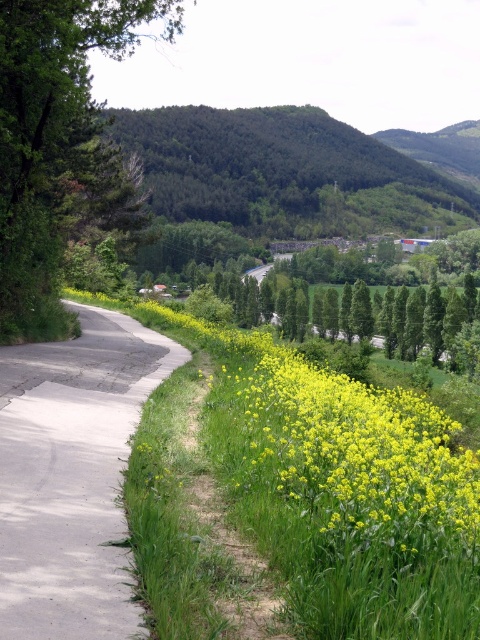
How distant is gray concrete road at center from yellow-green leafy plant at lower center?

gray concrete road at center and yellow-green leafy plant at lower center are 2.49 meters apart.

This screenshot has width=480, height=640. What do you see at coordinates (72, 476) in the screenshot?
I see `gray concrete road at center` at bounding box center [72, 476].

Is point (84, 589) positioned after point (452, 536)?

That is True.

Where is `gray concrete road at center`? The image size is (480, 640). gray concrete road at center is located at coordinates (72, 476).

Is green leafy tree at left shorter than yellow-green leafy plant at lower center?

No.

Which is more to the right, green leafy tree at left or yellow-green leafy plant at lower center?

Positioned to the right is yellow-green leafy plant at lower center.

What do you see at coordinates (59, 147) in the screenshot?
I see `green leafy tree at left` at bounding box center [59, 147].

Locate an element on the screen. green leafy tree at left is located at coordinates (59, 147).

Does gray concrete road at center have a larger size compared to green leafy tree at left?

Actually, gray concrete road at center might be smaller than green leafy tree at left.

Identify the location of gray concrete road at center. Image resolution: width=480 pixels, height=640 pixels. (72, 476).

Where is `gray concrete road at center`? The image size is (480, 640). gray concrete road at center is located at coordinates (72, 476).